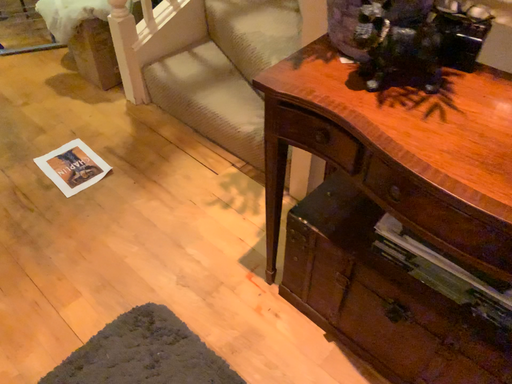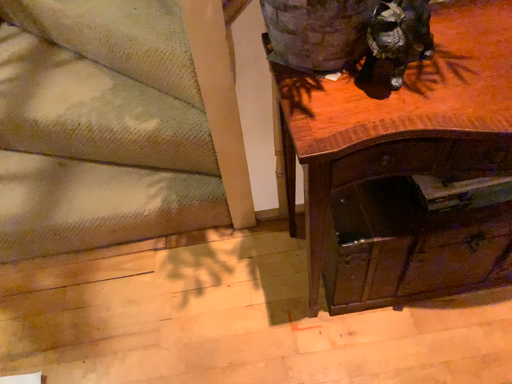
Question: How did the camera likely rotate when shooting the video?

Choices:
 (A) rotated upward
 (B) rotated downward

Answer: (A)